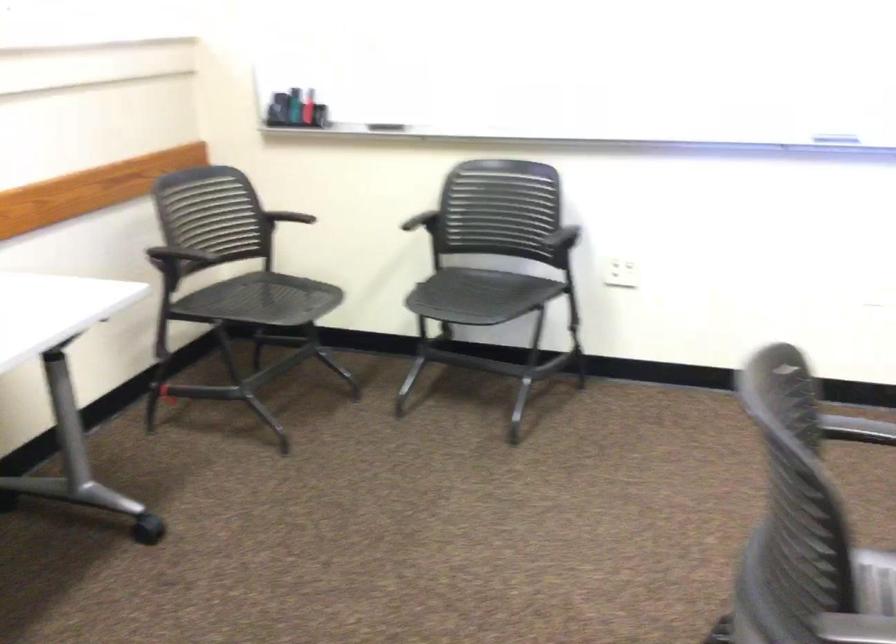
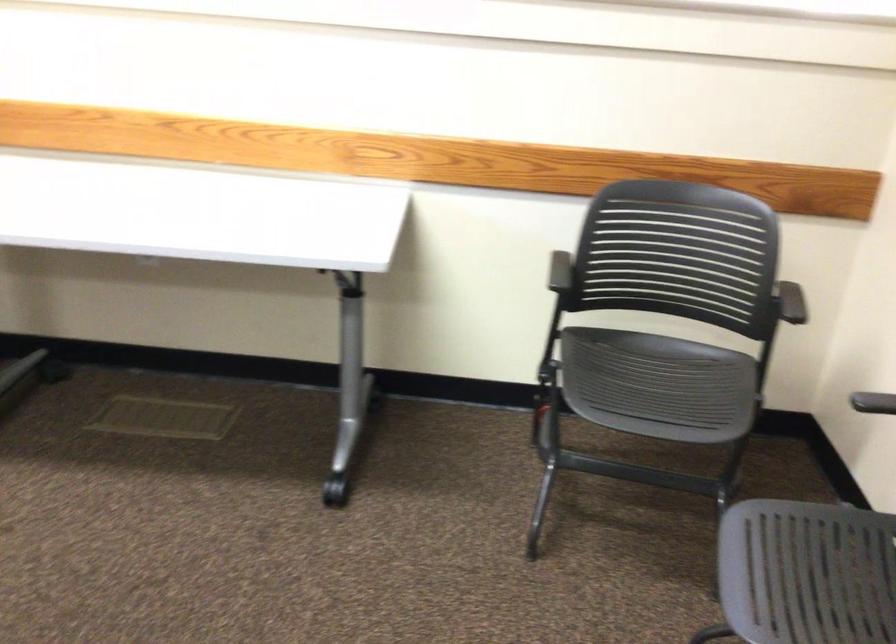
Find the pixel in the second image that matches (x=459, y=304) in the first image.

(806, 573)